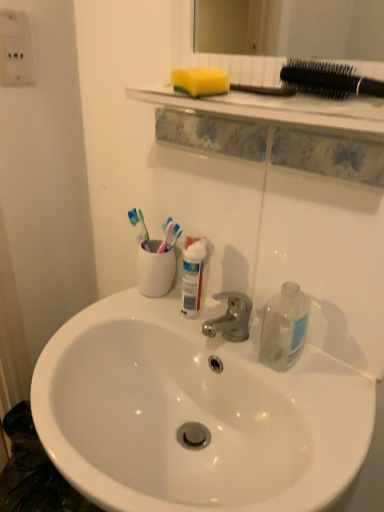
Question: From the image's perspective, is black plastic hairbrush at upper right below transparent glass bottle at right?

Choices:
 (A) yes
 (B) no

Answer: (B)

Question: Is the position of black plastic hairbrush at upper right less distant than that of transparent glass bottle at right?

Choices:
 (A) yes
 (B) no

Answer: (A)

Question: Could you tell me if black plastic hairbrush at upper right is facing transparent glass bottle at right?

Choices:
 (A) no
 (B) yes

Answer: (A)

Question: Would you say black plastic hairbrush at upper right is a long distance from transparent glass bottle at right?

Choices:
 (A) no
 (B) yes

Answer: (A)

Question: Can you confirm if black plastic hairbrush at upper right is bigger than transparent glass bottle at right?

Choices:
 (A) yes
 (B) no

Answer: (B)

Question: Would you say black plastic hairbrush at upper right is to the left or to the right of yellow sponge at upper center in the picture?

Choices:
 (A) right
 (B) left

Answer: (A)

Question: Based on their sizes in the image, would you say black plastic hairbrush at upper right is bigger or smaller than yellow sponge at upper center?

Choices:
 (A) small
 (B) big

Answer: (B)

Question: In terms of width, does black plastic hairbrush at upper right look wider or thinner when compared to yellow sponge at upper center?

Choices:
 (A) thin
 (B) wide

Answer: (A)

Question: Is black plastic hairbrush at upper right spatially inside yellow sponge at upper center, or outside of it?

Choices:
 (A) inside
 (B) outside

Answer: (B)

Question: From a real-world perspective, is black plastic hairbrush at upper right above or below transparent glass bottle at right?

Choices:
 (A) below
 (B) above

Answer: (B)

Question: Relative to transparent glass bottle at right, is black plastic hairbrush at upper right in front or behind?

Choices:
 (A) front
 (B) behind

Answer: (A)

Question: Is black plastic hairbrush at upper right bigger or smaller than transparent glass bottle at right?

Choices:
 (A) big
 (B) small

Answer: (B)

Question: In terms of height, does black plastic hairbrush at upper right look taller or shorter compared to transparent glass bottle at right?

Choices:
 (A) short
 (B) tall

Answer: (A)

Question: In the image, is transparent glass bottle at right positioned in front of or behind white plastic electric outlet at upper left?

Choices:
 (A) front
 (B) behind

Answer: (A)

Question: Considering the positions of transparent glass bottle at right and white plastic electric outlet at upper left in the image, is transparent glass bottle at right taller or shorter than white plastic electric outlet at upper left?

Choices:
 (A) tall
 (B) short

Answer: (B)